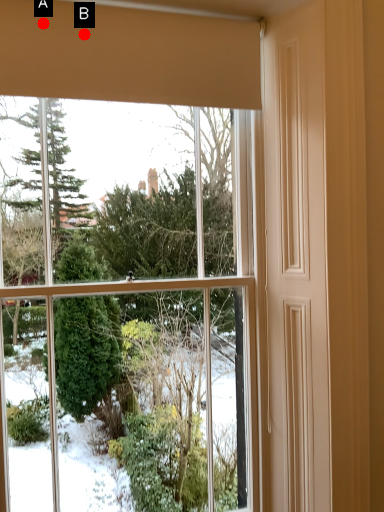
Question: Two points are circled on the image, labeled by A and B beside each circle. Which point is further to the camera?

Choices:
 (A) A is further
 (B) B is further

Answer: (B)